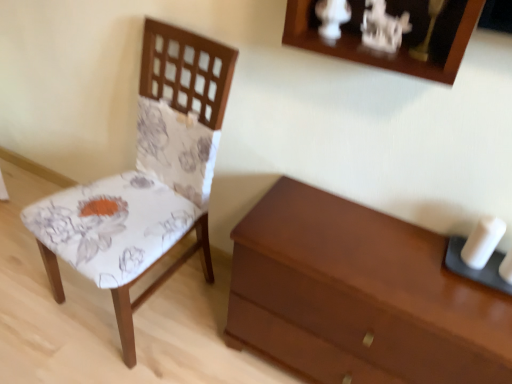
At what (x,y) coordinates should I click in order to perform the action: click on free space in front of white matte candle at right. Please return your answer as a coordinate pair (x, y). Looking at the image, I should click on (471, 301).